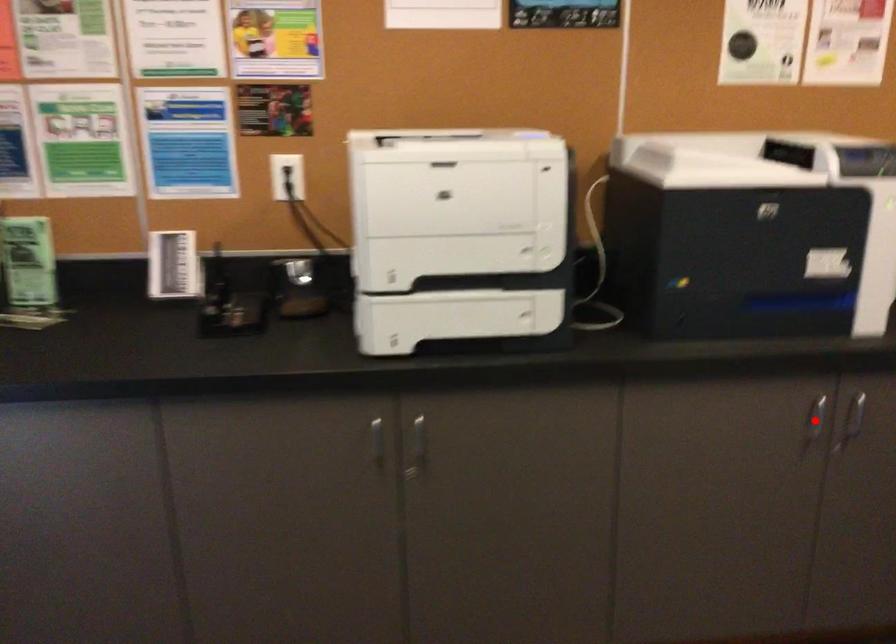
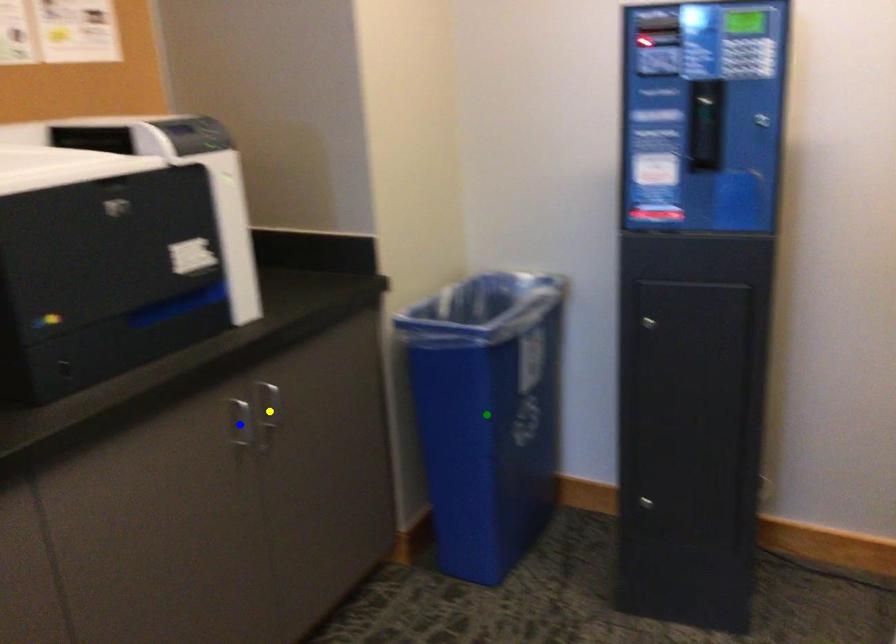
Question: I am providing you with two images of the same scene from different viewpoints. A red point is marked on the first image. You are given multiple points on the second image. Which spot in image 2 lines up with the point in image 1?

Choices:
 (A) blue point
 (B) yellow point
 (C) green point

Answer: (A)